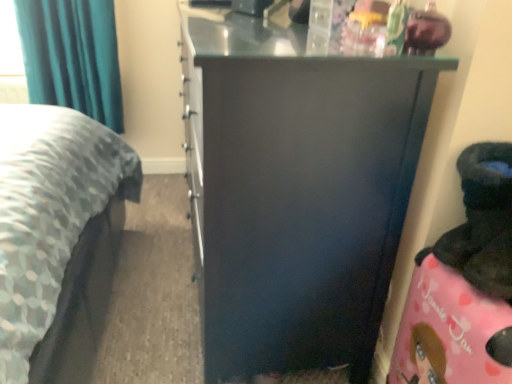
Question: Is teal fabric curtain at upper left bigger or smaller than matte black cabinet at center?

Choices:
 (A) big
 (B) small

Answer: (B)

Question: Looking at their shapes, would you say teal fabric curtain at upper left is wider or thinner than matte black cabinet at center?

Choices:
 (A) thin
 (B) wide

Answer: (A)

Question: Considering their positions, is teal fabric curtain at upper left located in front of or behind matte black cabinet at center?

Choices:
 (A) behind
 (B) front

Answer: (A)

Question: Considering the relative positions of matte black cabinet at center and teal fabric curtain at upper left in the image provided, is matte black cabinet at center to the left or to the right of teal fabric curtain at upper left?

Choices:
 (A) right
 (B) left

Answer: (A)

Question: Considering the positions of point (244, 21) and point (71, 94), is point (244, 21) closer or farther from the camera than point (71, 94)?

Choices:
 (A) closer
 (B) farther

Answer: (A)

Question: From a real-world perspective, is matte black cabinet at center above or below teal fabric curtain at upper left?

Choices:
 (A) below
 (B) above

Answer: (A)

Question: Is matte black cabinet at center in front of or behind teal fabric curtain at upper left in the image?

Choices:
 (A) behind
 (B) front

Answer: (B)